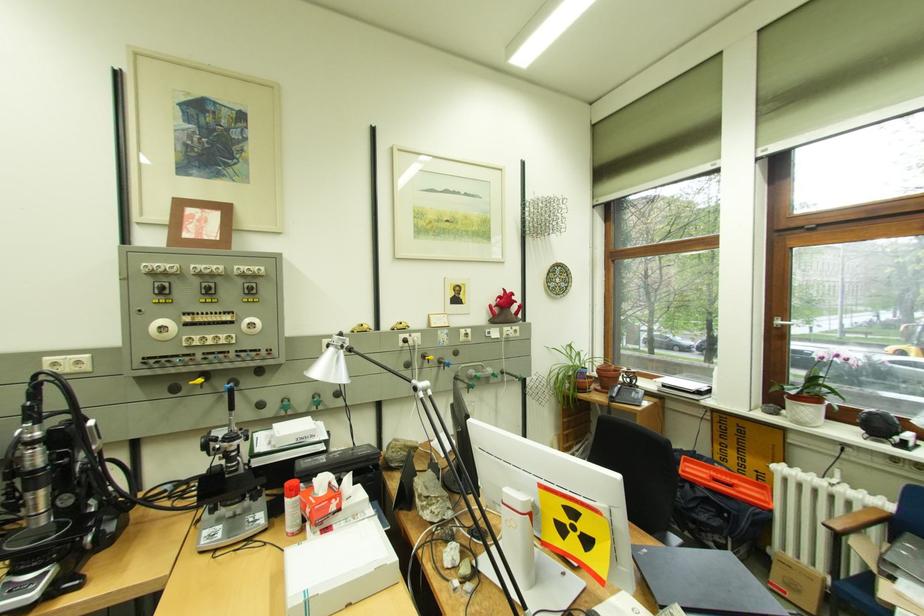
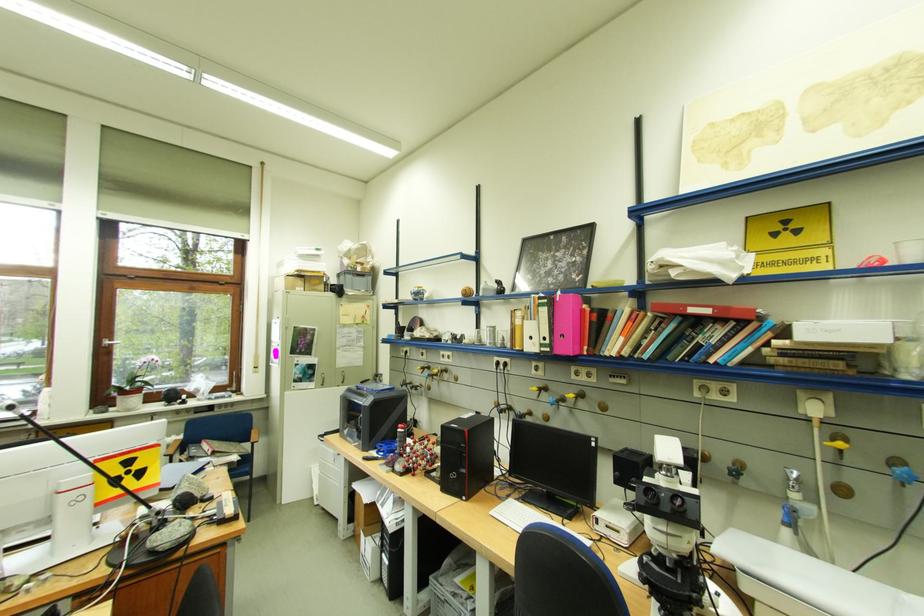
In the second image, find the point that corresponds to (788,323) in the first image.

(117, 342)